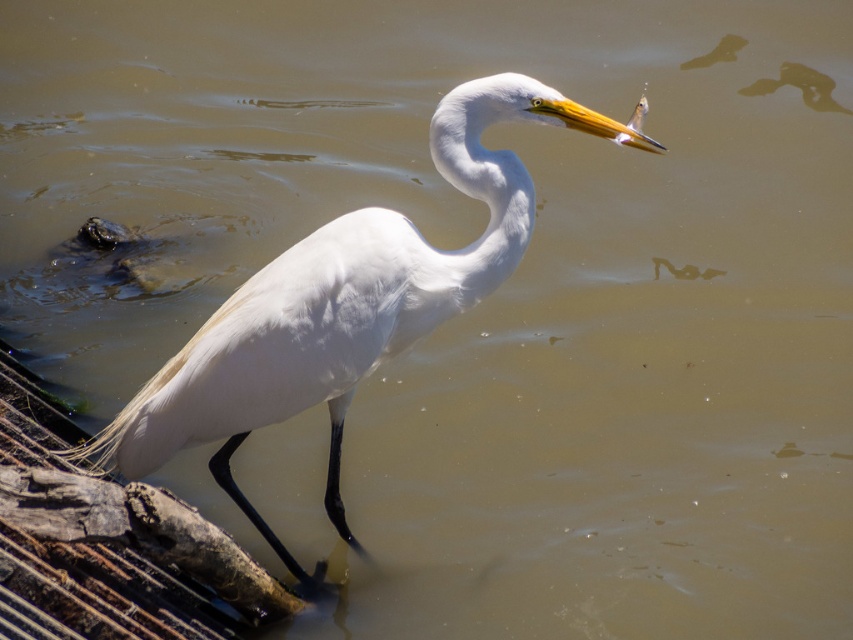
Does white feathered bird at center have a lesser width compared to white smooth neck at center?

Incorrect, white feathered bird at center's width is not less than white smooth neck at center's.

Which is in front, point (132, 417) or point (456, 147)?

Point (456, 147) is in front.

Where is `white feathered bird at center`? This screenshot has height=640, width=853. white feathered bird at center is located at coordinates (344, 305).

I want to click on white feathered bird at center, so click(344, 305).